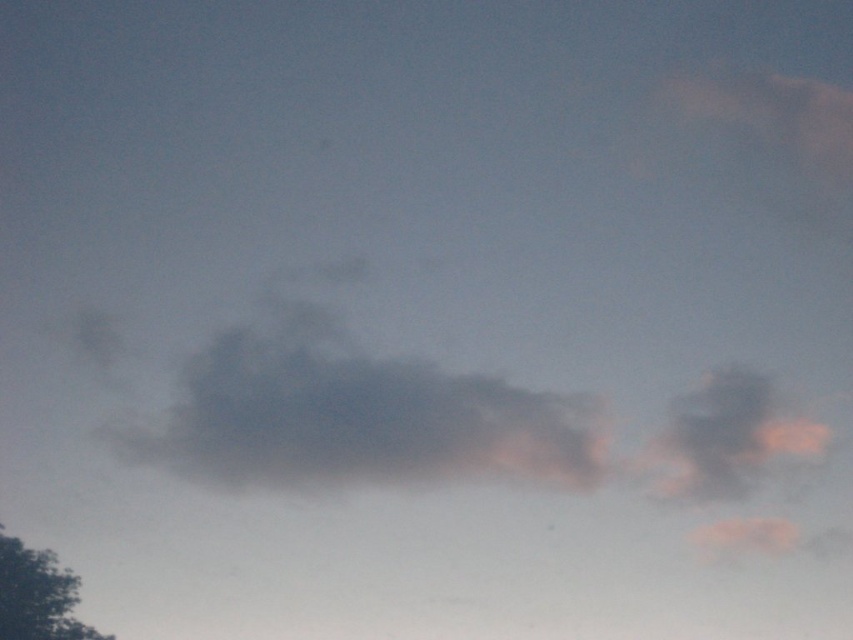
You are an airplane pilot flying at an altitude of 10,000 feet. You notice the dark gray fluffy cloud at center and the green leafy tree at lower left in your view. Which object is higher in the sky?

The dark gray fluffy cloud at center is above the green leafy tree at lower left, so the dark gray fluffy cloud at center is higher in the sky.